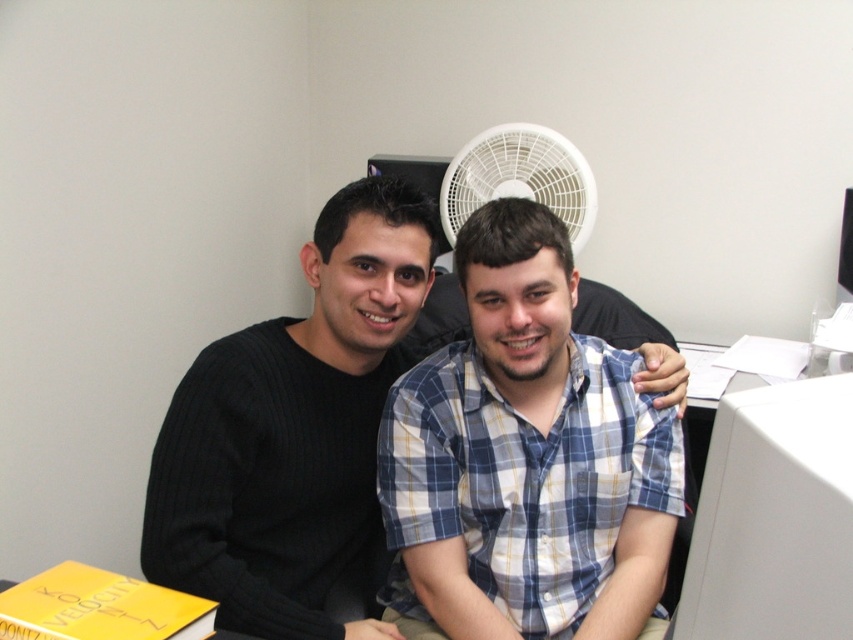
Between point (523, 637) and point (326, 632), which one is positioned behind?

Point (523, 637)

Which is below, blue plaid shirt at center or black ribbed sweater at left?

blue plaid shirt at center

Which is behind, point (555, 428) or point (367, 545)?

Point (367, 545)

The width and height of the screenshot is (853, 640). Find the location of `blue plaid shirt at center`. blue plaid shirt at center is located at coordinates (526, 458).

Does black ribbed sweater at left appear under white plastic fan at upper center?

Indeed, black ribbed sweater at left is positioned under white plastic fan at upper center.

Between black ribbed sweater at left and white plastic fan at upper center, which one has more height?

With more height is black ribbed sweater at left.

Is point (286, 604) in front of point (573, 227)?

Yes, point (286, 604) is in front of point (573, 227).

Identify the location of black ribbed sweater at left. The width and height of the screenshot is (853, 640). (294, 432).

Does blue plaid shirt at center appear on the left side of white plastic monitor at right?

Yes, blue plaid shirt at center is to the left of white plastic monitor at right.

Measure the distance between blue plaid shirt at center and camera.

A distance of 1.20 meters exists between blue plaid shirt at center and camera.

Is point (577, 412) more distant than point (805, 560)?

Yes, it is.

Find the location of a particular element. The image size is (853, 640). blue plaid shirt at center is located at coordinates (526, 458).